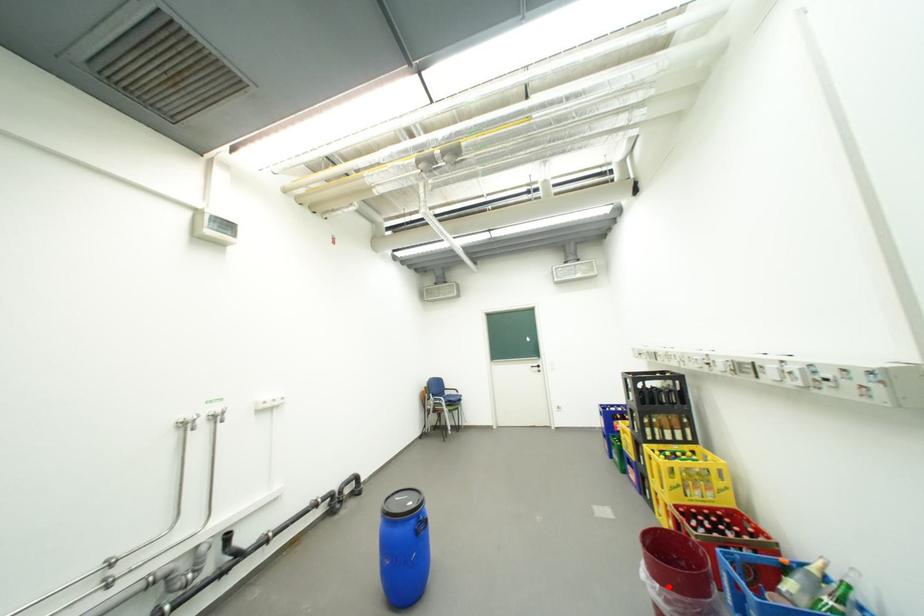
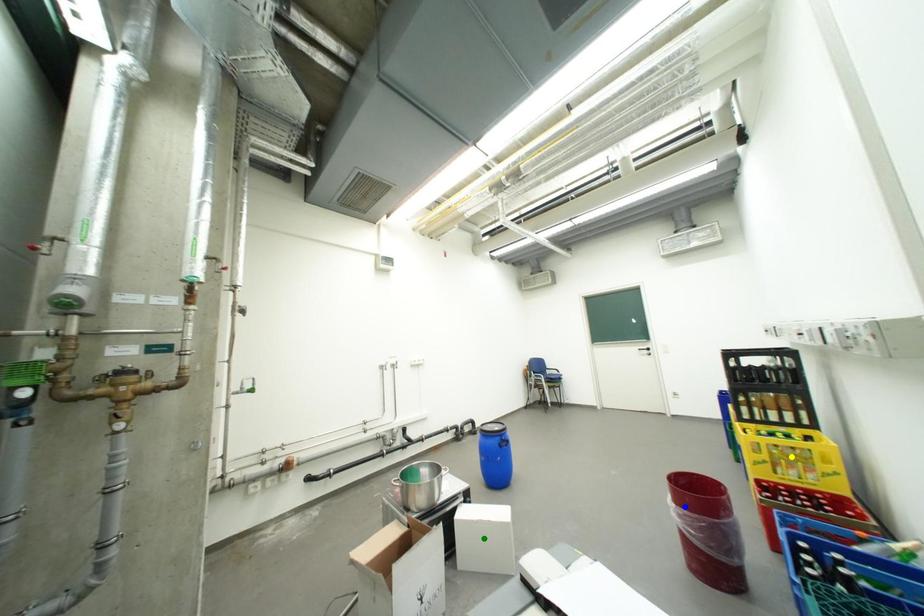
Question: I am providing you with two images of the same scene from different viewpoints. A red point is marked on the first image. You are given multiple points on the second image. Which point in image 2 is actually the same real-world point as the red point in image 1?

Choices:
 (A) yellow point
 (B) green point
 (C) blue point

Answer: (C)